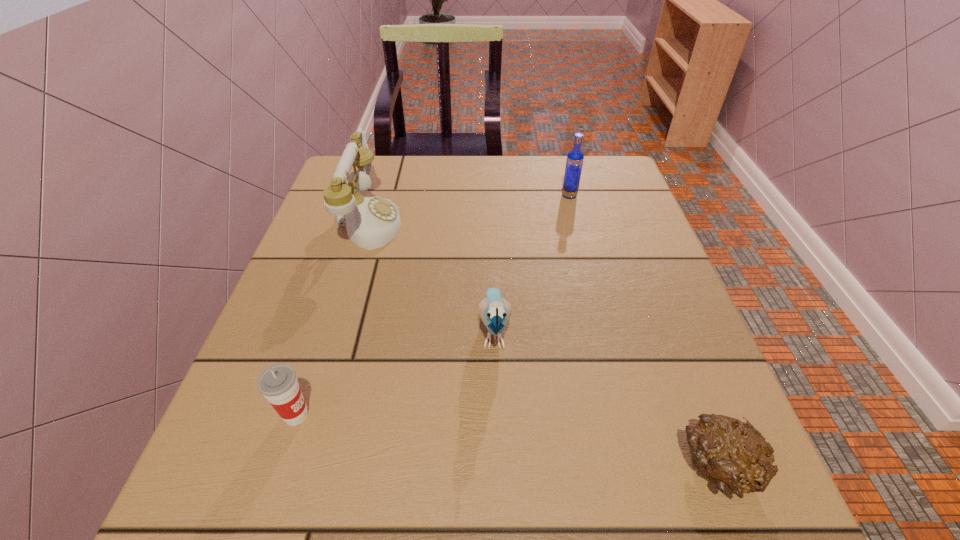
What are the coordinates of `vacant space located 0.400m on the side of the second nearest object with the logo` in the screenshot? It's located at tap(571, 415).

Where is `vacant space located on the back of the shortest object`? Image resolution: width=960 pixels, height=540 pixels. vacant space located on the back of the shortest object is located at coordinates (658, 307).

Locate an element on the screen. The height and width of the screenshot is (540, 960). telephone located in the far edge section of the desktop is located at coordinates (371, 222).

Image resolution: width=960 pixels, height=540 pixels. Identify the location of vodka positioned at the far edge. (574, 162).

Locate an element on the screen. This screenshot has height=540, width=960. object that is at the near edge is located at coordinates (733, 455).

Find the location of `telephone that is at the left edge`. telephone that is at the left edge is located at coordinates 371,222.

This screenshot has height=540, width=960. Find the location of `cup present at the left edge`. cup present at the left edge is located at coordinates (278, 383).

Find the location of `vodka present at the right edge`. vodka present at the right edge is located at coordinates (574, 162).

This screenshot has width=960, height=540. I want to click on muffin that is at the right edge, so pos(733,455).

You are a GUI agent. You are given a task and a screenshot of the screen. Output one action in this format:
    pyautogui.click(x=<x>, y=<y>)
    Task: Click on the object located in the far left corner section of the desktop
    
    Given the screenshot: What is the action you would take?
    pyautogui.click(x=371, y=222)